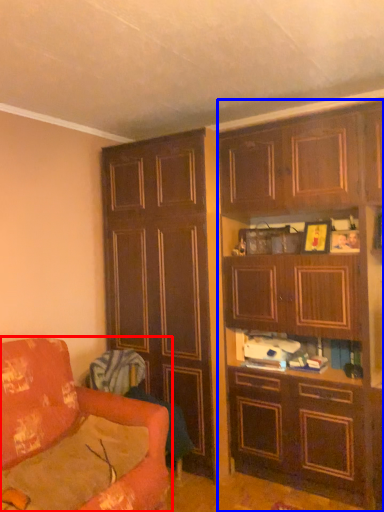
Question: Which object is further to the camera taking this photo, studio couch (highlighted by a red box) or cabinetry (highlighted by a blue box)?

Choices:
 (A) studio couch
 (B) cabinetry

Answer: (B)